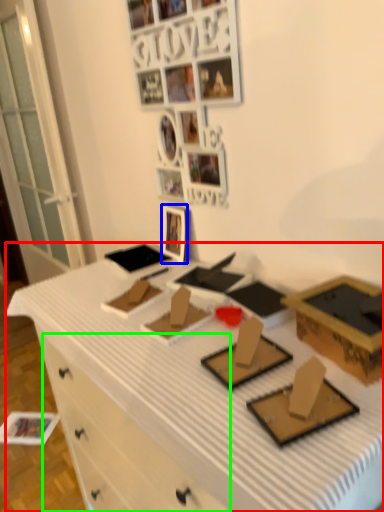
Question: Which object is the closest to the desk (highlighted by a red box)? Choose among these: picture frame (highlighted by a blue box) or drawer (highlighted by a green box).

Choices:
 (A) picture frame
 (B) drawer

Answer: (B)